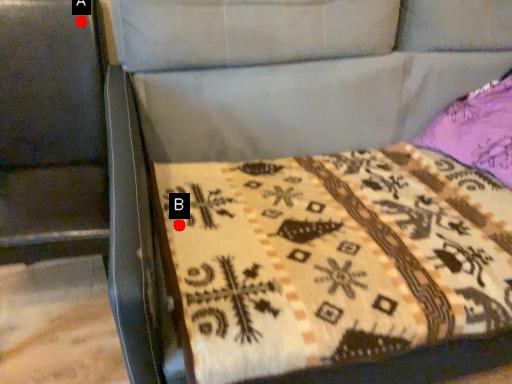
Question: Two points are circled on the image, labeled by A and B beside each circle. Among these points, which one is farthest from the camera?

Choices:
 (A) A is further
 (B) B is further

Answer: (A)